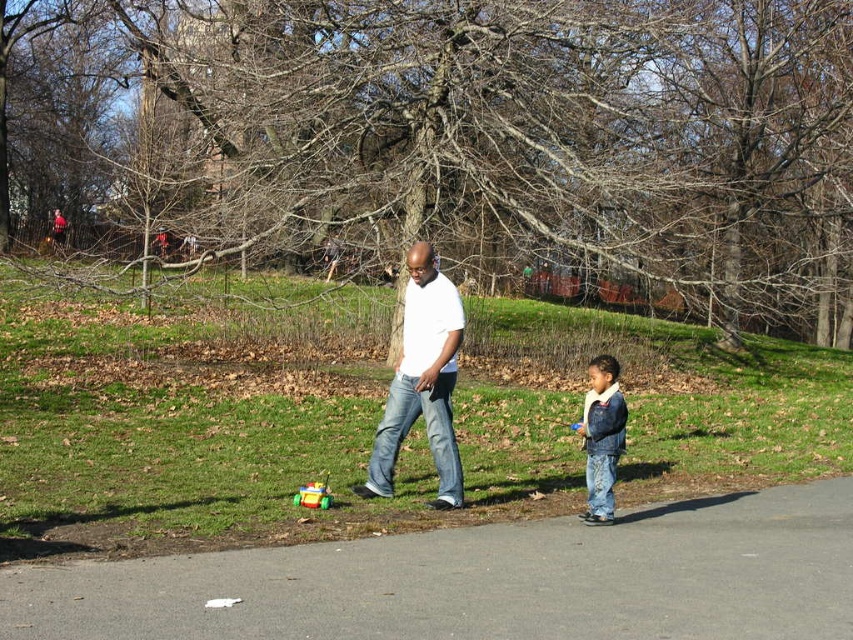
Question: Can you confirm if white matte shirt at center is positioned above denim jacket at lower right?

Choices:
 (A) no
 (B) yes

Answer: (B)

Question: Among these objects, which one is nearest to the camera?

Choices:
 (A) denim jacket at lower right
 (B) white matte shirt at center
 (C) gray asphalt pavement at lower center

Answer: (C)

Question: Which point is farther from the camera taking this photo?

Choices:
 (A) coord(605,451)
 (B) coord(525,538)

Answer: (A)

Question: Is denim jacket at lower right positioned behind rubberized plastic toy at lower center?

Choices:
 (A) yes
 (B) no

Answer: (B)

Question: Which point appears closest to the camera in this image?

Choices:
 (A) (728, 518)
 (B) (190, 456)
 (C) (595, 518)
 (D) (311, 506)

Answer: (C)

Question: Can you confirm if gray asphalt pavement at lower center is thinner than denim jacket at lower right?

Choices:
 (A) no
 (B) yes

Answer: (A)